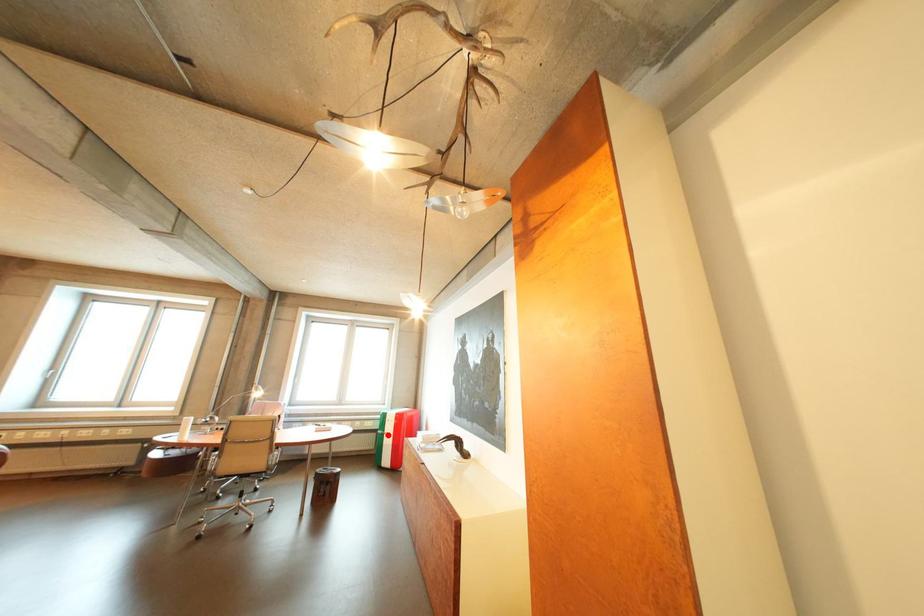
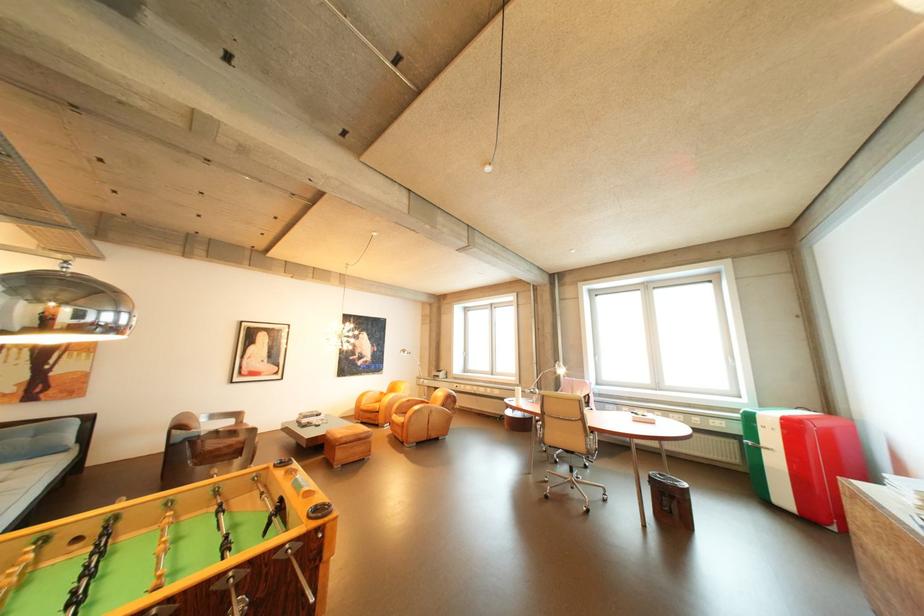
Locate, in the second image, the point that corresponds to the highlighted location in the first image.

(748, 443)